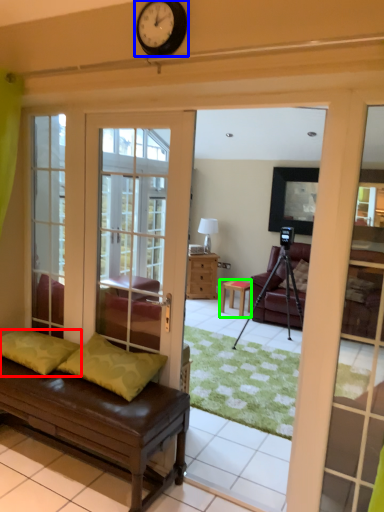
Question: Based on their relative distances, which object is farther from pillow (highlighted by a red box)? Choose from clock (highlighted by a blue box) and table (highlighted by a green box).

Choices:
 (A) clock
 (B) table

Answer: (B)